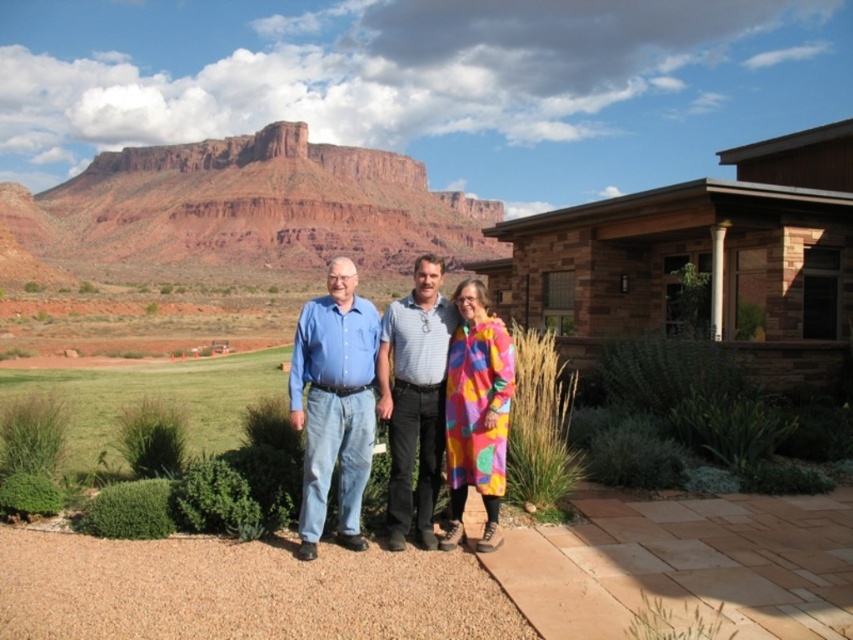
Is point (144, 188) less distant than point (393, 481)?

No, (144, 188) is further to viewer.

Is red rock cliff at upper center smaller than multicolored fabric at center?

Result: Actually, red rock cliff at upper center might be larger than multicolored fabric at center.

Identify the location of red rock cliff at upper center. (253, 205).

Who is shorter, multicolored fabric at center or gray textured shirt at center?

With less height is gray textured shirt at center.

In the scene shown: Does multicolored fabric at center have a smaller size compared to gray textured shirt at center?

Actually, multicolored fabric at center might be larger than gray textured shirt at center.

Identify the location of multicolored fabric at center. The image size is (853, 640). (415, 396).

Who is higher up, red rock cliff at upper center or multicolored fabric coat at center?

red rock cliff at upper center

Is point (120, 180) farther from camera compared to point (474, 452)?

Yes, it is.

The height and width of the screenshot is (640, 853). Identify the location of red rock cliff at upper center. (253, 205).